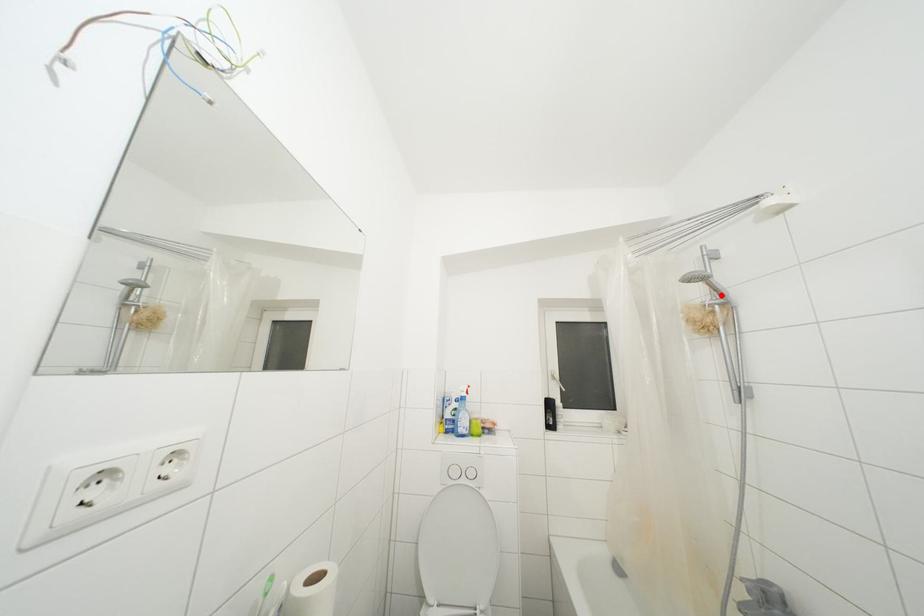
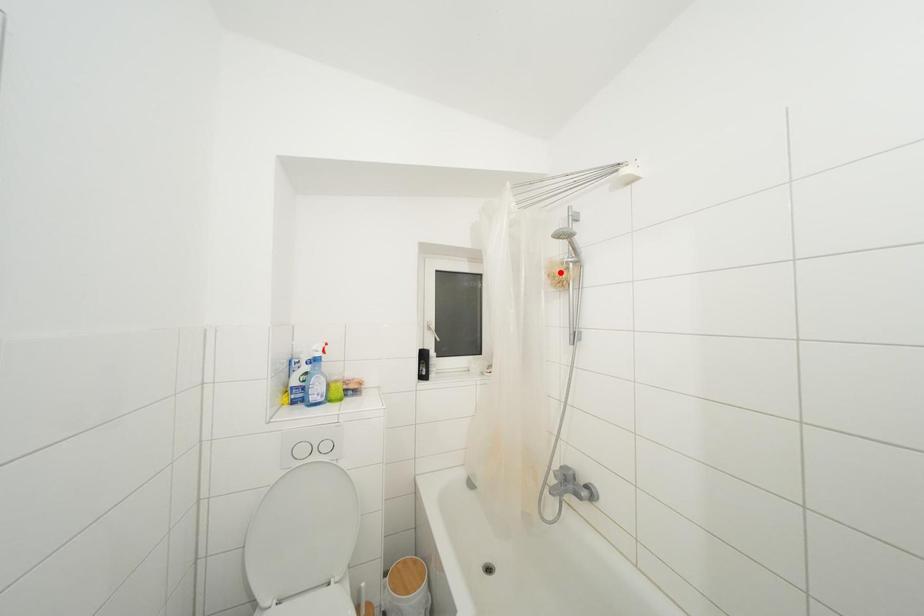
I am providing you with two images of the same scene from different viewpoints. A red point is marked on the first image and another point is marked on the second image. Are the points marked in image1 and image2 representing the same 3D position?

No